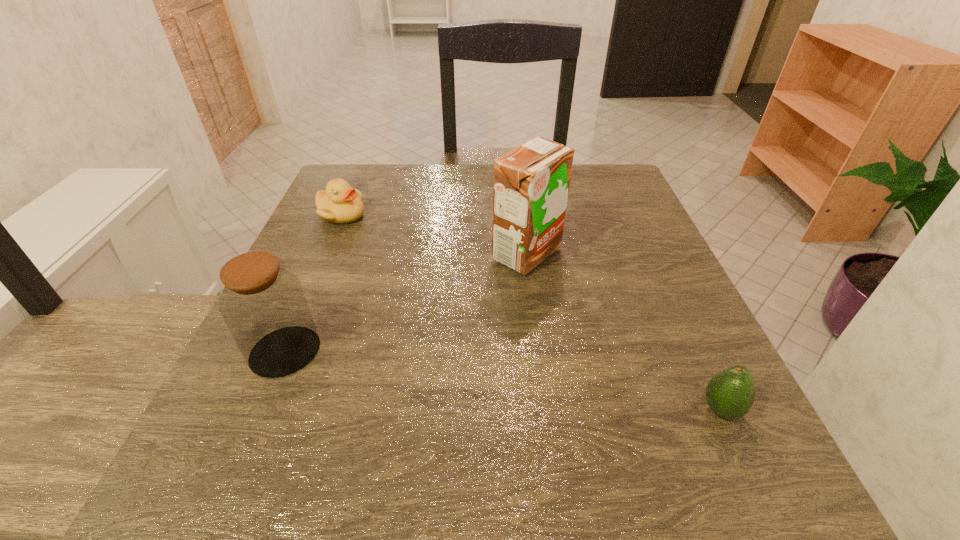
Identify the location of free region that satisfies the following two spatial constraints: 1. on the straw side of the third nearest object; 2. on the back side of the nearest object. (546, 409).

In order to click on free point that satisfies the following two spatial constraints: 1. on the beak of the farthest object; 2. on the left side of the third shortest object in this screenshot , I will do `click(282, 352)`.